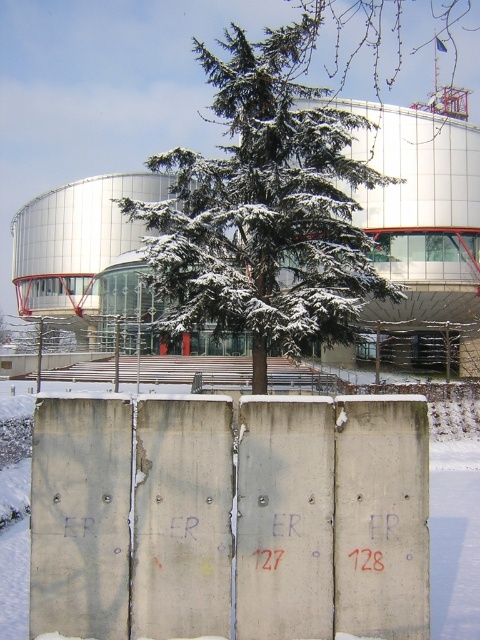
Question: Can you confirm if concrete textured barrier at center is thinner than snow-covered evergreen at center?

Choices:
 (A) yes
 (B) no

Answer: (A)

Question: Among these objects, which one is nearest to the camera?

Choices:
 (A) concrete textured barrier at center
 (B) snow-covered evergreen at center

Answer: (A)

Question: Is concrete textured barrier at center bigger than snow-covered evergreen at center?

Choices:
 (A) yes
 (B) no

Answer: (B)

Question: Does concrete textured barrier at center have a greater width compared to snow-covered evergreen at center?

Choices:
 (A) yes
 (B) no

Answer: (B)